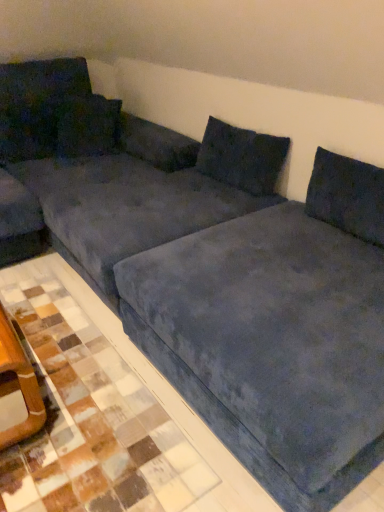
Question: Is velvet dark blue pillow at upper left, arranged as the second pillow when viewed from the right, wider or thinner than velvet dark blue pillow at upper left, which ranks as the third pillow in right-to-left order?

Choices:
 (A) thin
 (B) wide

Answer: (B)

Question: From a real-world perspective, is velvet dark blue pillow at upper left, arranged as the second pillow when viewed from the right, physically located above or below velvet dark blue pillow at upper left, positioned as the 1th pillow in left-to-right order?

Choices:
 (A) above
 (B) below

Answer: (A)

Question: Which object is the closest to the velvet dark blue pillow at upper left, which ranks as the third pillow in right-to-left order?

Choices:
 (A) blue suede tile at lower right
 (B) velvet blue couch at center
 (C) velvet dark blue pillow at upper left, arranged as the second pillow when viewed from the right
 (D) velvet dark blue pillow at upper center, positioned as the 1th pillow in right-to-left order

Answer: (C)

Question: Estimate the real-world distances between objects in this image. Which object is closer to the blue suede tile at lower right?

Choices:
 (A) velvet blue couch at center
 (B) velvet dark blue pillow at upper left, which is the second pillow in left-to-right order
 (C) velvet dark blue pillow at upper left, which ranks as the third pillow in right-to-left order
 (D) velvet dark blue pillow at upper center, the third pillow when ordered from left to right

Answer: (A)